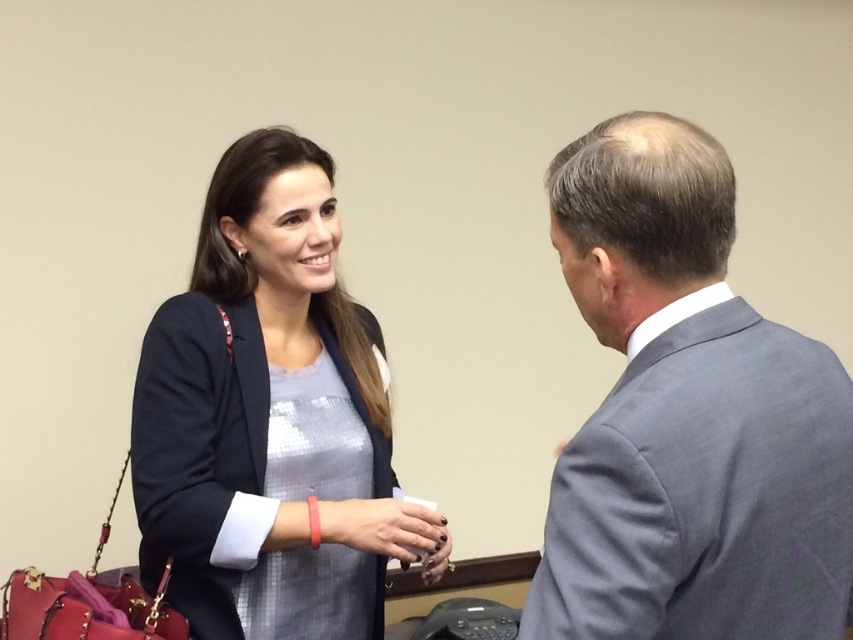
Is point (289, 410) positioned behind point (436, 561)?

No.

Find the location of a particular element. The height and width of the screenshot is (640, 853). satin blue blazer at center is located at coordinates (267, 412).

Identify the location of satin blue blazer at center. (267, 412).

Can you confirm if gray wool suit at right is wider than satin blue blazer at center?

No.

Is gray wool suit at right to the left of satin blue blazer at center from the viewer's perspective?

In fact, gray wool suit at right is to the right of satin blue blazer at center.

Which is in front, point (785, 496) or point (386, 460)?

Point (785, 496) is in front.

You are a GUI agent. You are given a task and a screenshot of the screen. Output one action in this format:
    pyautogui.click(x=<x>, y=<y>)
    Task: Click on the gray wool suit at right
    The image size is (853, 640).
    Given the screenshot: What is the action you would take?
    (x=688, y=417)

Is gray wool suit at right taller than matte black hand at center?

Indeed, gray wool suit at right has a greater height compared to matte black hand at center.

Which is behind, point (786, 451) or point (328, 506)?

Point (328, 506)

At what (x,y) coordinates should I click in order to perform the action: click on gray wool suit at right. Please return your answer as a coordinate pair (x, y). The height and width of the screenshot is (640, 853). Looking at the image, I should click on (688, 417).